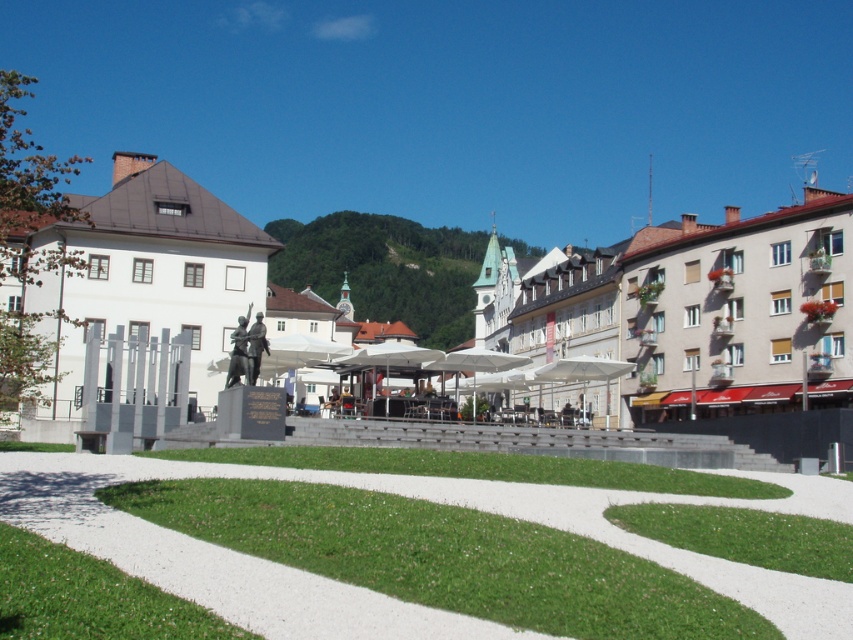
You are a gardener who needs to water the green grass at center and the bronze statue at center. Since you can only water one area at a time, which one should you water first if you want to water the area closer to you?

A: The green grass at center is in front of the bronze statue at center, so you should water the green grass at center first as it is closer to you.

You are a gardener who needs to mow the green grass at center and clean the bronze statue at center. Which task should you prioritize if you want to start with the smaller area first?

The green grass at center has a smaller size compared to the bronze statue at center, so you should prioritize mowing the green grass at center first.

From the picture: You are a city planner assessing the urban square. You need to place a new bench between the polished stone statue at center and the bronze statue at center. Which statue should the bench be closer to if it must be placed closer to the wider statue?

The bench should be placed closer to the polished stone statue at center because it might be wider than the bronze statue at center.